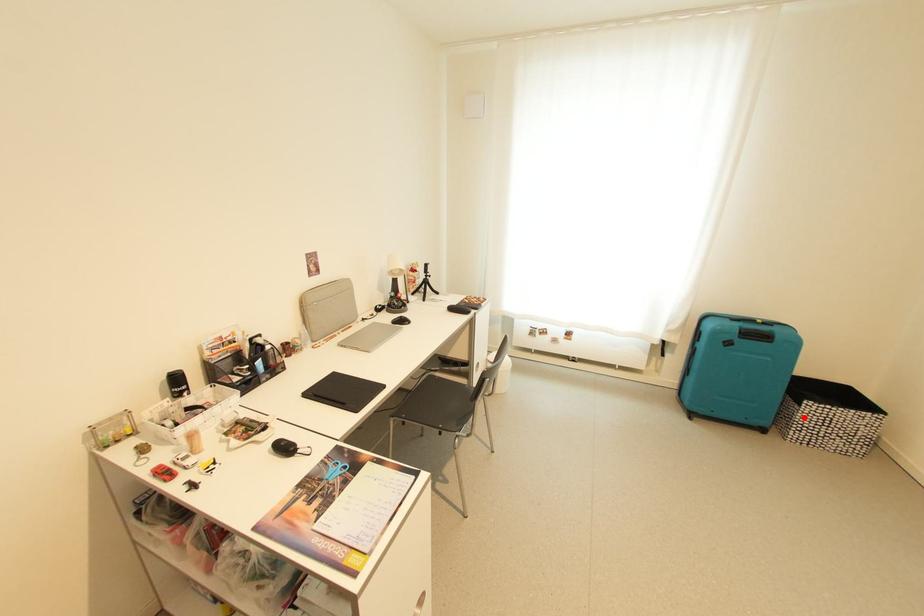
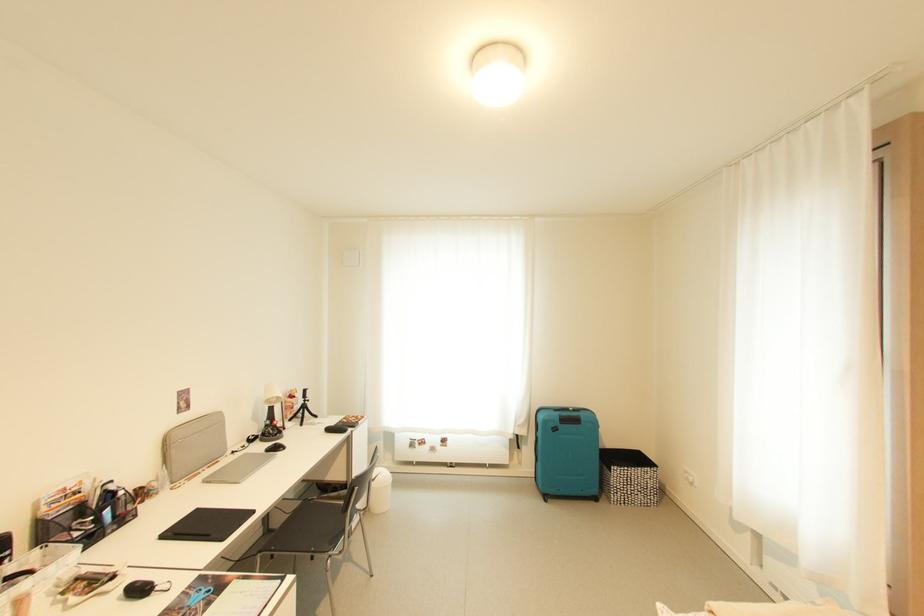
Where in the second image is the point corresponding to the highlighted location from the first image?

(617, 482)